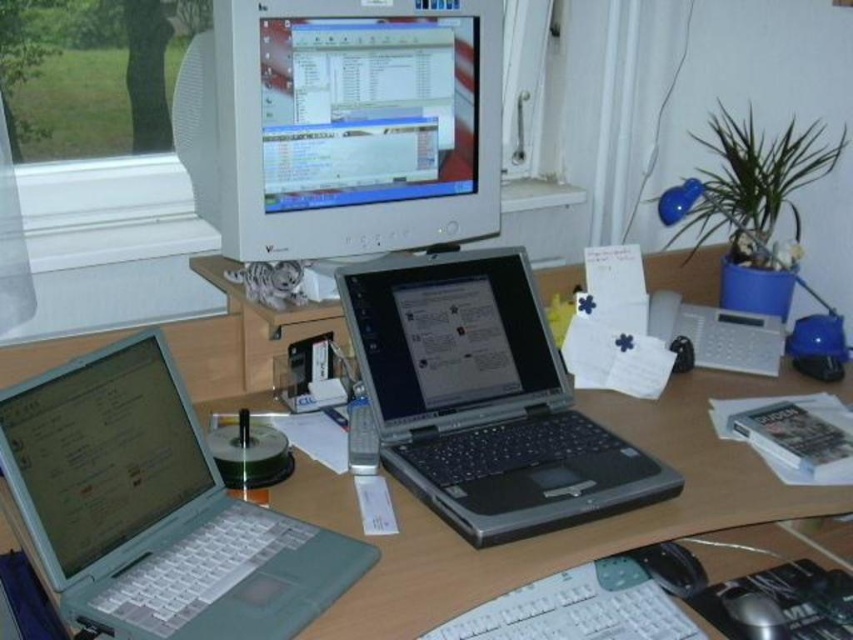
You are a delivery person who needs to place a small package on the desk without moving any of the existing items. The package is 0.3 meters wide. Is there enough space between the white glossy computer monitor at upper center and the edge of the desk closest to you to safely place the package?

The distance of white glossy computer monitor at upper center from camera is 1.19 meters. However, the exact space between the monitor and the desk edge isn t specified. Without knowing the desk s total length or the monitor s position relative to the edge, it s impossible to determine if 0.3 meters of space is available. Please check the desk s dimensions or move existing items to create space.

You need to place a new wireless charger that requires 20 cm of space between the silver metallic laptop at left and the black plastic mouse at lower right. Based on their current positions, is there enough space between them?

The silver metallic laptop at left is larger than the black plastic mouse at lower right, but the exact distance between them isn t specified in the description. Therefore, it s uncertain if there s enough space for the wireless charger.

You are standing at the desk and want to reach both points. Which point is closer to you, point (62, 452) or point (741, 600)?

Point (62, 452) is in front of point (741, 600), so it is closer to you.